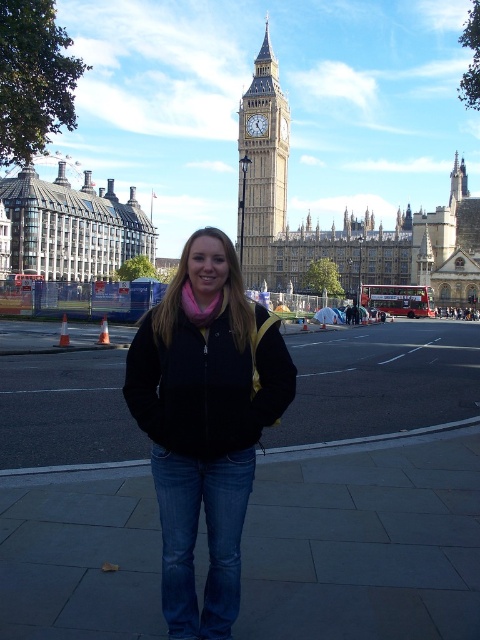
Is black fleece jacket at center below beige stone clock tower at upper center?

Correct, black fleece jacket at center is located below beige stone clock tower at upper center.

Based on the photo, who is more forward, (189, 429) or (275, 109)?

Point (189, 429) is in front.

You are a GUI agent. You are given a task and a screenshot of the screen. Output one action in this format:
    pyautogui.click(x=<x>, y=<y>)
    Task: Click on the black fleece jacket at center
    
    Given the screenshot: What is the action you would take?
    pyautogui.click(x=204, y=422)

Does stone building at left appear on the right side of beige stone clock tower at upper center?

Incorrect, stone building at left is not on the right side of beige stone clock tower at upper center.

Is stone building at left thinner than beige stone clock tower at upper center?

Incorrect, stone building at left's width is not less than beige stone clock tower at upper center's.

Is point (141, 228) farther from viewer compared to point (285, 193)?

Yes, it is.

Identify the location of stone building at left. Image resolution: width=480 pixels, height=640 pixels. (72, 227).

Is point (208, 364) farther from viewer compared to point (74, 208)?

No, (208, 364) is in front of (74, 208).

You are a GUI agent. You are given a task and a screenshot of the screen. Output one action in this format:
    pyautogui.click(x=<x>, y=<y>)
    Task: Click on the black fleece jacket at center
    This screenshot has height=640, width=480.
    Given the screenshot: What is the action you would take?
    pyautogui.click(x=204, y=422)